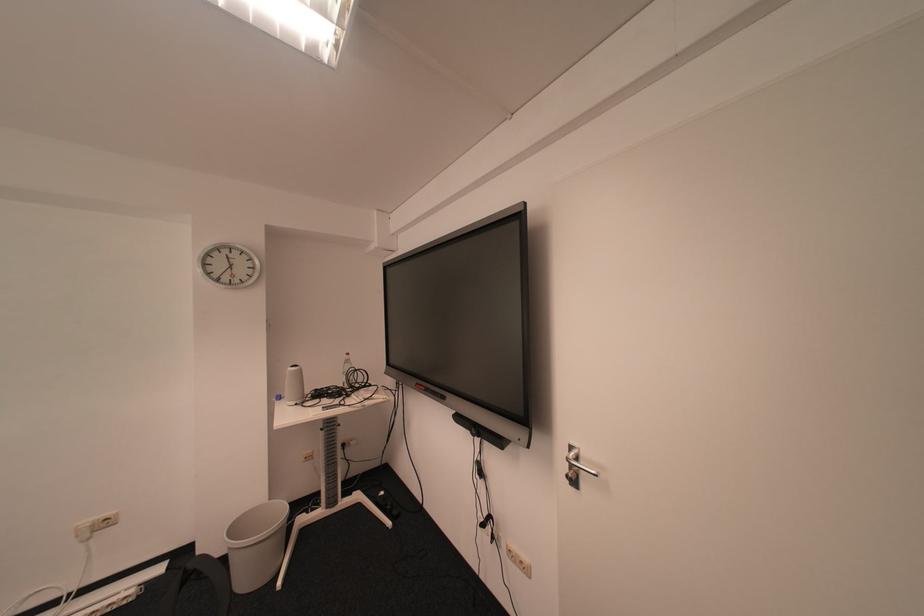
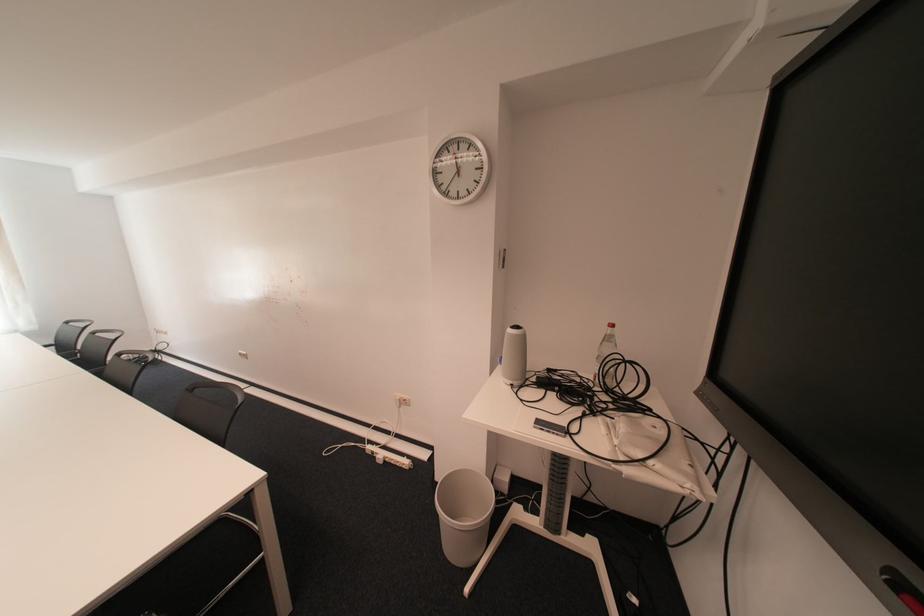
Where in the second image is the point corresponding to point 357,363 from the first image?

(614, 341)